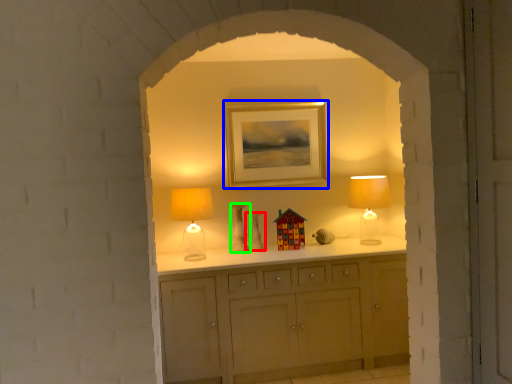
Question: Estimate the real-world distances between objects in this image. Which object is closer to vase (highlighted by a red box), picture frame (highlighted by a blue box) or vase (highlighted by a green box)?

Choices:
 (A) picture frame
 (B) vase

Answer: (B)